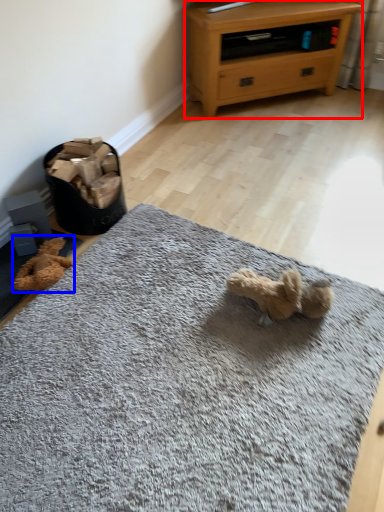
Question: Which of the following is the closest to the observer, chest of drawers (highlighted by a red box) or teddy (highlighted by a blue box)?

Choices:
 (A) chest of drawers
 (B) teddy

Answer: (B)